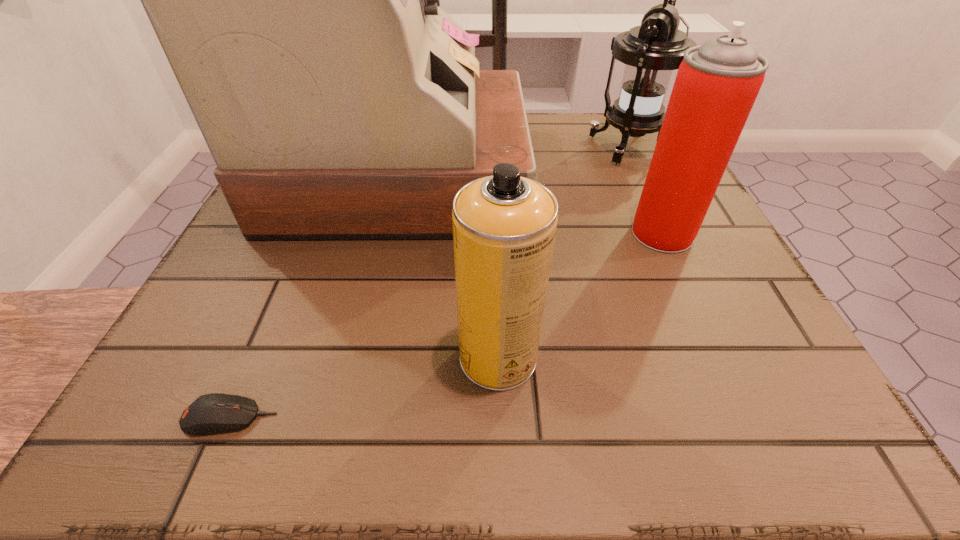
This screenshot has width=960, height=540. I want to click on free spot that satisfies the following two spatial constraints: 1. on the operating side of the cash register; 2. on the back side of the right aerosol can, so click(x=387, y=233).

Identify the location of vacant position in the image that satisfies the following two spatial constraints: 1. on the back side of the right aerosol can; 2. on the right side of the lantern. (622, 146).